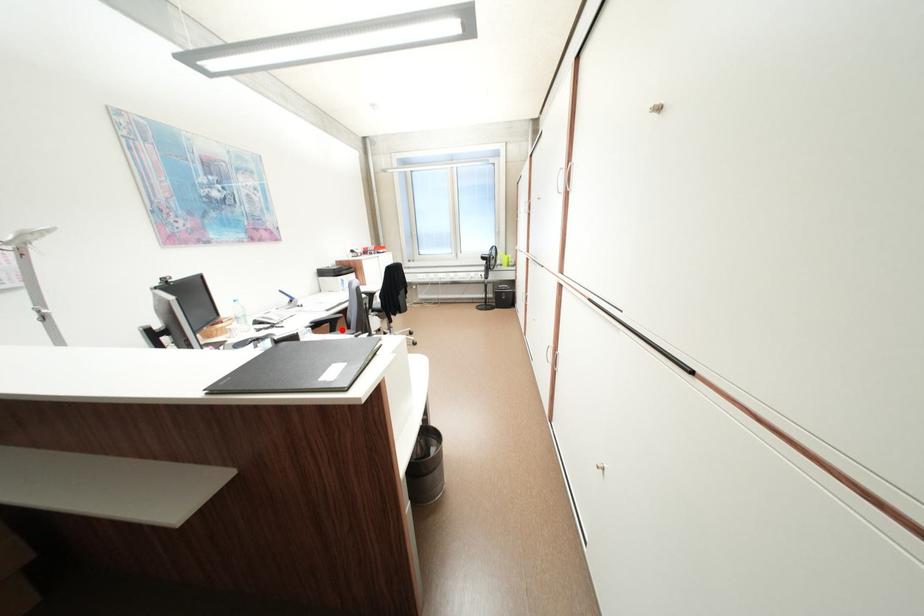
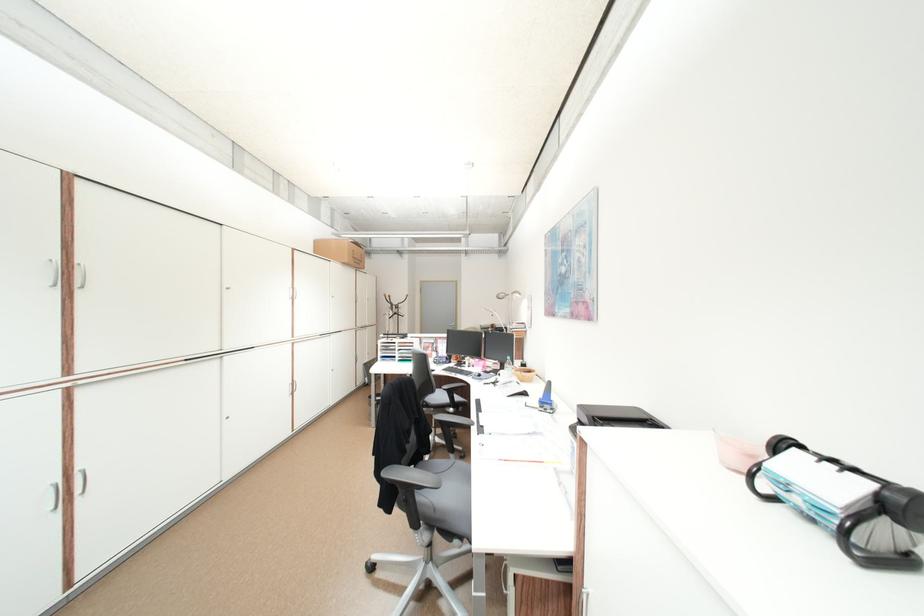
Question: I am providing you with two images of the same scene from different viewpoints. A red point is marked on the first image. Is the red point's position out of view in image 2?

Choices:
 (A) Yes
 (B) No

Answer: (A)